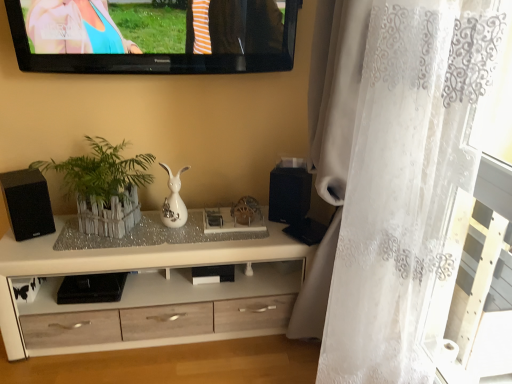
Identify the location of blank space situated above white wood cabinet at center (from a real-world perspective). (158, 235).